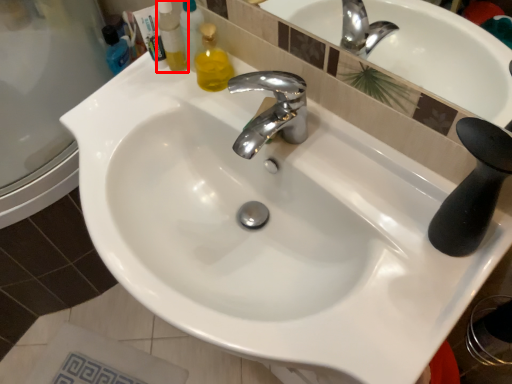
Question: From the image, what is the correct spatial relationship of cleaning product (annotated by the red box) in relation to tap?

Choices:
 (A) left
 (B) right

Answer: (A)